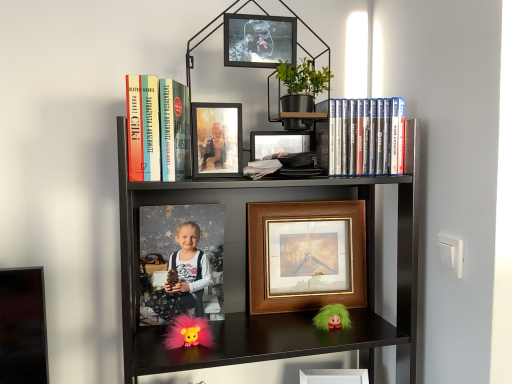
Question: In the image, is matte black dress at center on the left side or the right side of black matte bookcase at upper center?

Choices:
 (A) left
 (B) right

Answer: (A)

Question: Is matte black dress at center bigger or smaller than black matte bookcase at upper center?

Choices:
 (A) small
 (B) big

Answer: (A)

Question: Which object is the farthest from the matte wooden photo frame at upper center, which is counted as the second picture frame, starting from the top?

Choices:
 (A) black matte bookcase at upper center
 (B) fuzzy pink doll at lower center
 (C) matte plastic dvds at upper right, which is the second book in left-to-right order
 (D) metallic photo frame at upper center, which is the 4th picture frame in back-to-front order
 (E) hardcover book at upper left, which ranks as the second book in right-to-left order

Answer: (B)

Question: Which object is the farthest from the fuzzy pink doll at lower center?

Choices:
 (A) matte black dress at center
 (B) woodenobject at center, the 3th picture frame from the top
 (C) metallic photo frame at upper center, which is the first picture frame in top-to-bottom order
 (D) wooden picture frame at lower center, the second picture frame when ordered from back to front
 (E) hardcover book at upper left, which ranks as the second book in right-to-left order

Answer: (C)